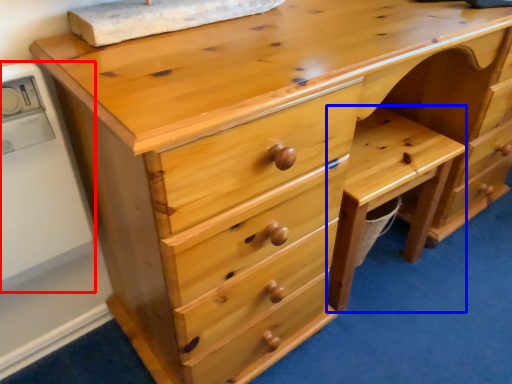
Question: Which point is closer to the camera, appliance (highlighted by a red box) or cabinetry (highlighted by a blue box)?

Choices:
 (A) appliance
 (B) cabinetry

Answer: (A)